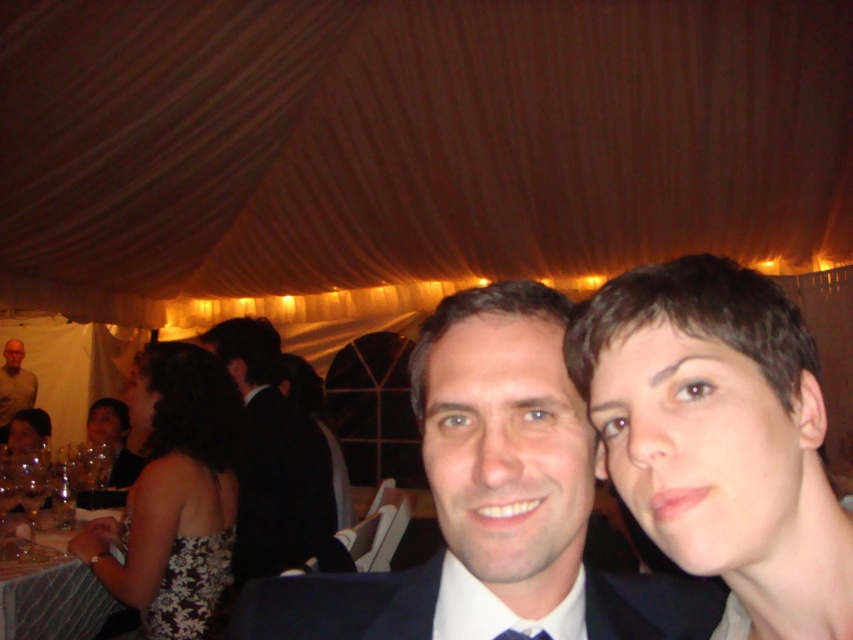
Which is below, black floral dress at lower left or blue silk tie at center?

black floral dress at lower left is lower down.

Who is positioned more to the left, black floral dress at lower left or blue silk tie at center?

black floral dress at lower left

Between point (161, 577) and point (511, 634), which one is positioned behind?

The point (161, 577) is behind.

You are a GUI agent. You are given a task and a screenshot of the screen. Output one action in this format:
    pyautogui.click(x=<x>, y=<y>)
    Task: Click on the black floral dress at lower left
    
    Given the screenshot: What is the action you would take?
    pyautogui.click(x=190, y=589)

Does short hair at center appear on the right side of matte black suit at center?

Yes, short hair at center is to the right of matte black suit at center.

Can you confirm if short hair at center is positioned above matte black suit at center?

Yes, short hair at center is above matte black suit at center.

Which is behind, point (621, 394) or point (445, 426)?

Positioned behind is point (445, 426).

This screenshot has width=853, height=640. I want to click on short hair at center, so click(718, 435).

Is matte black suit at center to the left of light brown shirt at left from the viewer's perspective?

No, matte black suit at center is not to the left of light brown shirt at left.

Is matte black suit at center behind light brown shirt at left?

No.

This screenshot has height=640, width=853. What do you see at coordinates (492, 496) in the screenshot? I see `matte black suit at center` at bounding box center [492, 496].

Where is `matte black suit at center`? This screenshot has width=853, height=640. matte black suit at center is located at coordinates (492, 496).